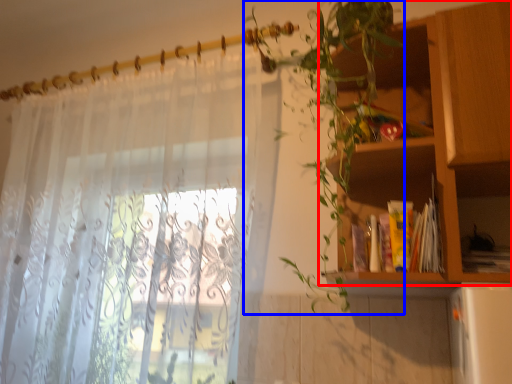
Question: Which object is further to the camera taking this photo, shelf (highlighted by a red box) or vegetation (highlighted by a blue box)?

Choices:
 (A) shelf
 (B) vegetation

Answer: (A)